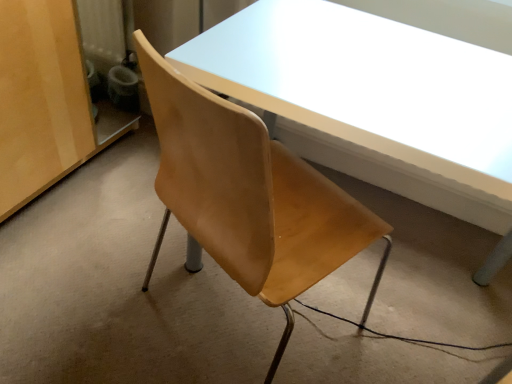
Where is `blank space above matte white table at center (from a real-world perspective)`? The image size is (512, 384). blank space above matte white table at center (from a real-world perspective) is located at coordinates 380,71.